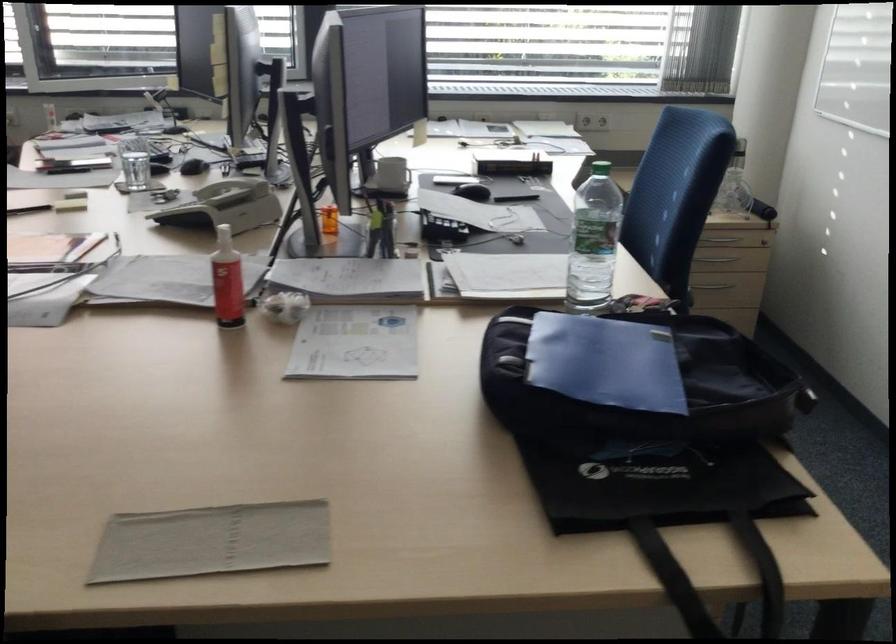
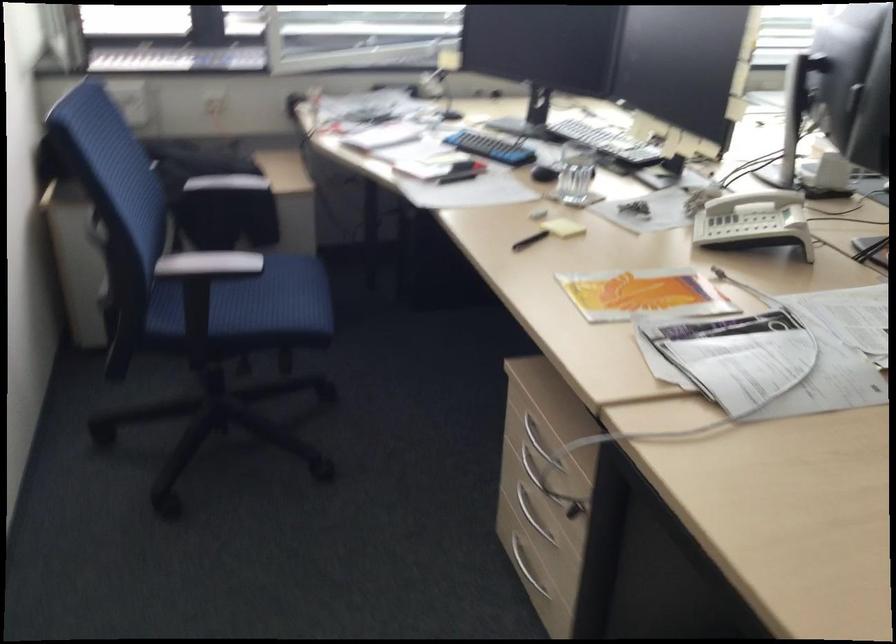
The point at (245, 190) is marked in the first image. Where is the corresponding point in the second image?

(753, 200)